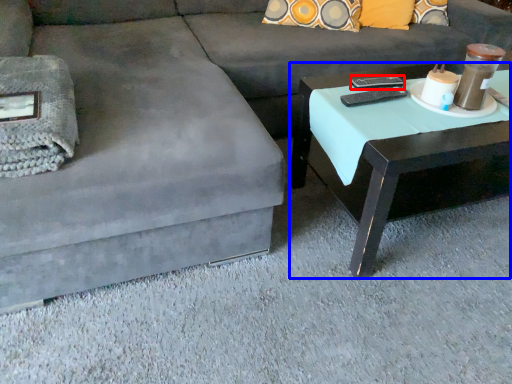
Question: Among these objects, which one is nearest to the camera, remote (highlighted by a red box) or coffee table (highlighted by a blue box)?

Choices:
 (A) remote
 (B) coffee table

Answer: (B)